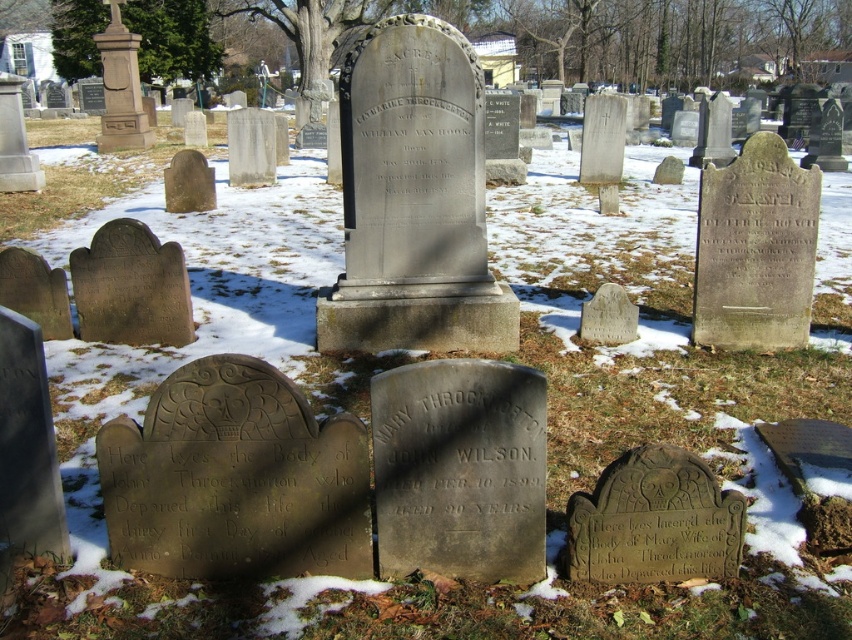
You are standing in the winter cemetery and notice two trees at the upper center of the scene. Which tree, the green textured tree at upper center or the bare wood tree at upper center, has a larger size?

The green textured tree at upper center is bigger than the bare wood tree at upper center, so the green textured tree at upper center has a larger size.

You are standing at the center of the cemetery and want to take a photo of the green leafy tree at upper left. Which direction should you face to capture it in your view?

The green leafy tree at upper left is located at point (171,38), which is to the upper left direction from your current position at the center. You should face the upper left direction to capture it in your view.